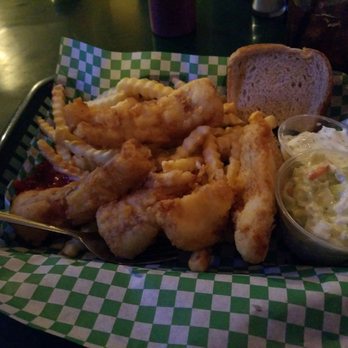
At what (x,y) coordinates should I click in order to perform the action: click on plastic cup. Please return your answer as a coordinate pair (x, y). Looking at the image, I should click on (290, 168), (296, 125).